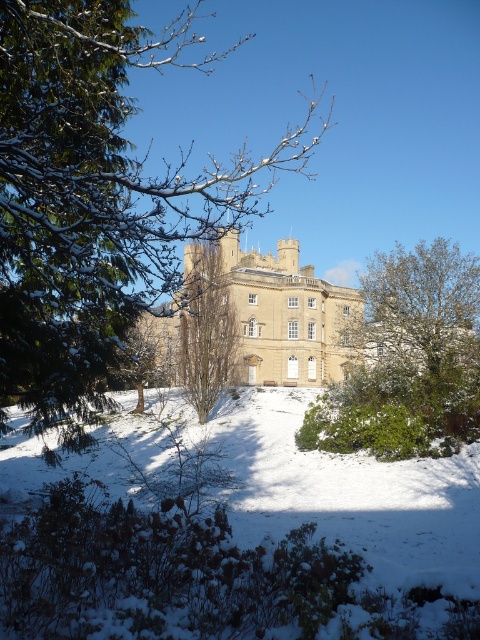
Question: Estimate the real-world distances between objects in this image. Which object is closer to the green leafy bush at lower right?

Choices:
 (A) beige stone castle at center
 (B) green textured tree at upper left
 (C) brown textured tree at center

Answer: (A)

Question: Which is nearer to the green leafy bush at lower right?

Choices:
 (A) green textured tree at upper left
 (B) brown textured tree at center

Answer: (B)

Question: Considering the real-world distances, which object is closest to the green leafy bush at lower right?

Choices:
 (A) green textured tree at upper left
 (B) beige stone castle at center
 (C) brown textured tree at center

Answer: (B)

Question: Can you confirm if green leafy bush at lower right is wider than beige stone castle at center?

Choices:
 (A) no
 (B) yes

Answer: (A)

Question: Observing the image, what is the correct spatial positioning of green textured tree at upper left in reference to brown textured tree at center?

Choices:
 (A) below
 (B) above

Answer: (B)

Question: Does beige stone castle at center have a smaller size compared to brown textured tree at center?

Choices:
 (A) yes
 (B) no

Answer: (B)